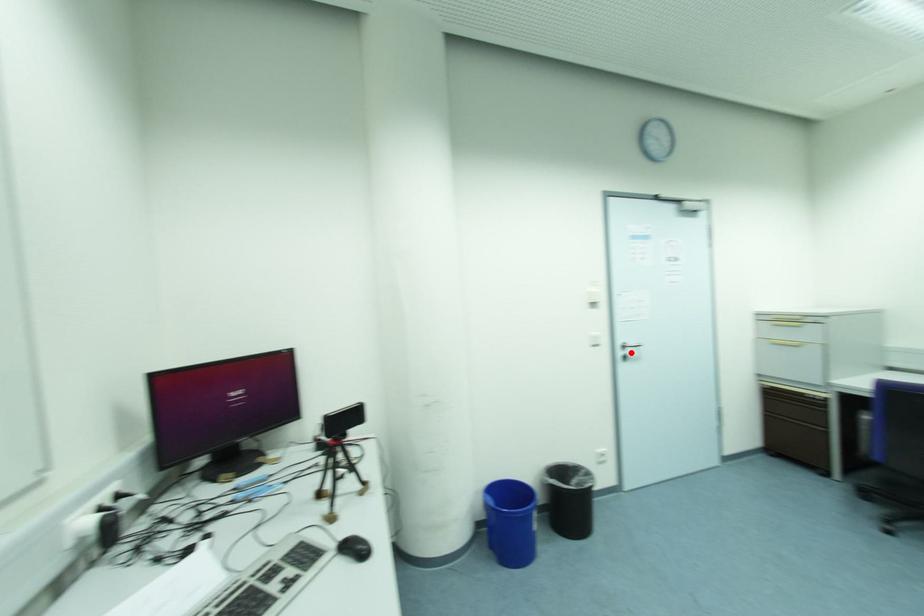
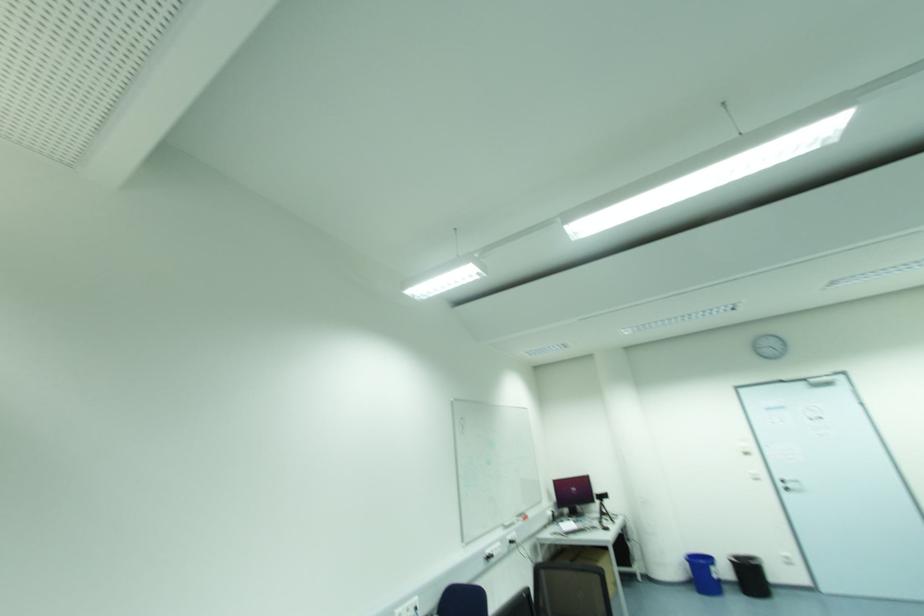
Question: I am providing you with two images of the same scene from different viewpoints. Given a red point in image1, look at the same physical point in image2. Is it:

Choices:
 (A) Closer to the viewpoint
 (B) Farther from the viewpoint

Answer: (A)